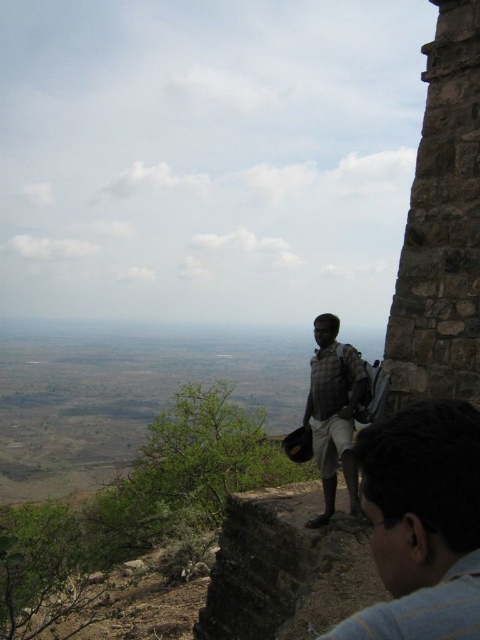
Can you confirm if blue denim shirt at lower right is wider than checkered fabric shirt at center?

In fact, blue denim shirt at lower right might be narrower than checkered fabric shirt at center.

Between point (393, 609) and point (336, 445), which one is positioned behind?

The point (336, 445) is behind.

What are the coordinates of `blue denim shirt at lower right` in the screenshot? It's located at (421, 524).